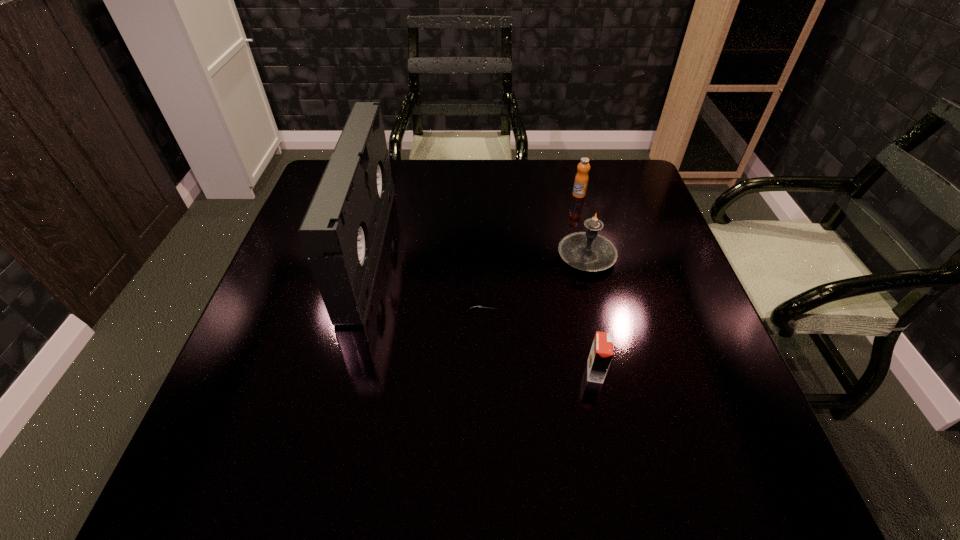
In order to click on free space between the shears and the candle in this screenshot , I will do `click(532, 280)`.

This screenshot has width=960, height=540. In order to click on free space between the second object from left to right and the second tallest object in this screenshot , I will do `click(532, 280)`.

The image size is (960, 540). In order to click on object that is the fourth closest to the shortest object in this screenshot , I will do `click(581, 180)`.

Locate which object is the third closest to the second object from left to right. Please provide its 2D coordinates. Your answer should be formatted as a tuple, i.e. [(x, y)], where the tuple contains the x and y coordinates of a point satisfying the conditions above.

[(601, 353)]

Image resolution: width=960 pixels, height=540 pixels. What are the coordinates of `free spot that satisfies the following two spatial constraints: 1. on the side of the left orange juice with visible spindles; 2. on the right side of the leftmost object` in the screenshot? It's located at (337, 372).

You are a GUI agent. You are given a task and a screenshot of the screen. Output one action in this format:
    pyautogui.click(x=<x>, y=<y>)
    Task: Click on the free space that satisfies the following two spatial constraints: 1. on the side of the shortest object with visible spindles; 2. on the left side of the leftmost object
    The image size is (960, 540).
    Given the screenshot: What is the action you would take?
    pyautogui.click(x=355, y=303)

Image resolution: width=960 pixels, height=540 pixels. What are the coordinates of `vacant area that satisfies the following two spatial constraints: 1. on the side of the second shortest object with visible spindles; 2. on the left side of the videotape` in the screenshot? It's located at (337, 372).

Locate an element on the screen. This screenshot has height=540, width=960. free location that satisfies the following two spatial constraints: 1. on the side of the tallest object with visible spindles; 2. on the left side of the nearest object is located at coordinates (337, 372).

At what (x,y) coordinates should I click in order to perform the action: click on free space that satisfies the following two spatial constraints: 1. on the side of the nearer orange juice with visible spindles; 2. on the left side of the videotape. Please return your answer as a coordinate pair (x, y). Looking at the image, I should click on (337, 372).

You are a GUI agent. You are given a task and a screenshot of the screen. Output one action in this format:
    pyautogui.click(x=<x>, y=<y>)
    Task: Click on the vacant region that satisfies the following two spatial constraints: 1. on the front label of the taller orange juice; 2. on the side of the videotape with visible spindles
    
    Given the screenshot: What is the action you would take?
    coord(593,249)